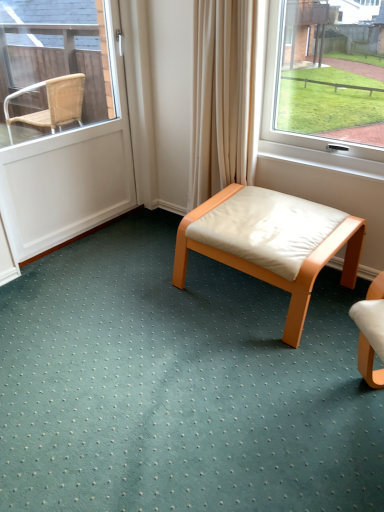
I want to click on free spot in front of white matte door at left, so click(x=94, y=283).